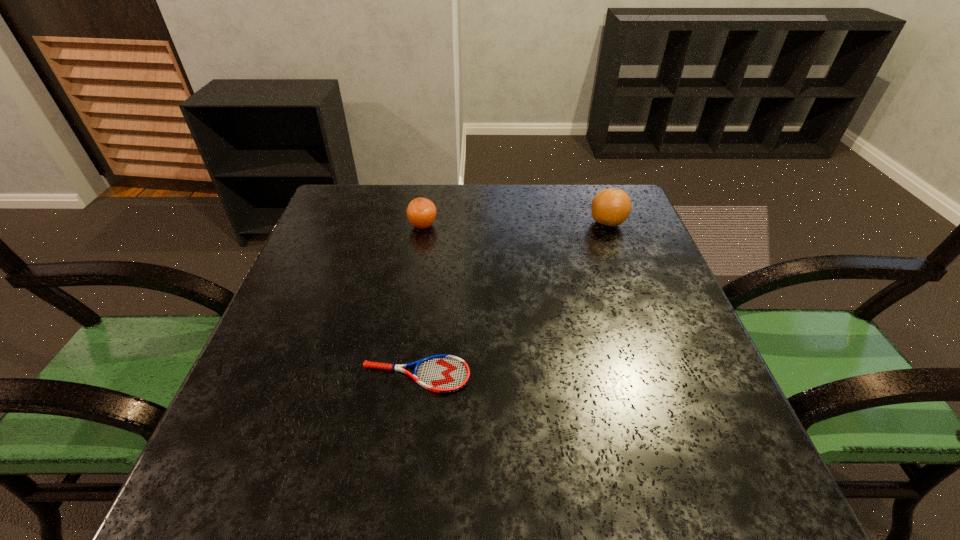
You are a GUI agent. You are given a task and a screenshot of the screen. Output one action in this format:
    pyautogui.click(x=<x>, y=<y>)
    Task: Click on the object at the far right corner
    Image resolution: width=960 pixels, height=540 pixels.
    Given the screenshot: What is the action you would take?
    pyautogui.click(x=611, y=207)

This screenshot has height=540, width=960. Identify the location of free space at the far edge of the desktop. (456, 202).

Where is `vacant area at the near edge`? This screenshot has width=960, height=540. vacant area at the near edge is located at coordinates (539, 480).

Locate an element on the screen. This screenshot has width=960, height=540. vacant space at the left edge of the desktop is located at coordinates (340, 249).

Image resolution: width=960 pixels, height=540 pixels. I want to click on vacant region at the right edge of the desktop, so click(x=667, y=347).

Where is `vacant area at the far left corner`? vacant area at the far left corner is located at coordinates (352, 218).

Locate an element on the screen. This screenshot has height=540, width=960. vacant space at the far right corner is located at coordinates (586, 214).

At what (x,y) coordinates should I click in order to perform the action: click on vacant area at the near right corner of the desktop. Please return your answer as a coordinate pair (x, y). Looking at the image, I should click on (705, 488).

In order to click on free space between the second shortest object and the right orange in this screenshot , I will do `click(516, 224)`.

Locate an element on the screen. The image size is (960, 540). free spot between the taller orange and the left orange is located at coordinates (516, 224).